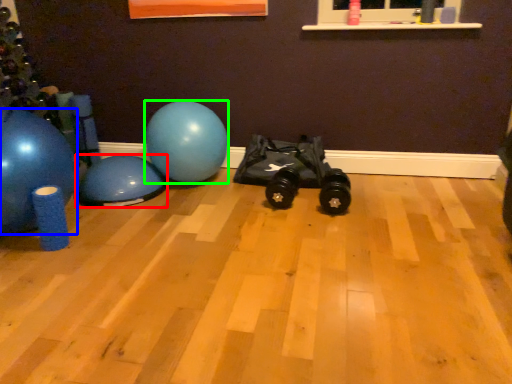
Question: Based on their relative distances, which object is farther from ball (highlighted by a red box)? Choose from ball (highlighted by a blue box) and ball (highlighted by a green box).

Choices:
 (A) ball
 (B) ball

Answer: (A)